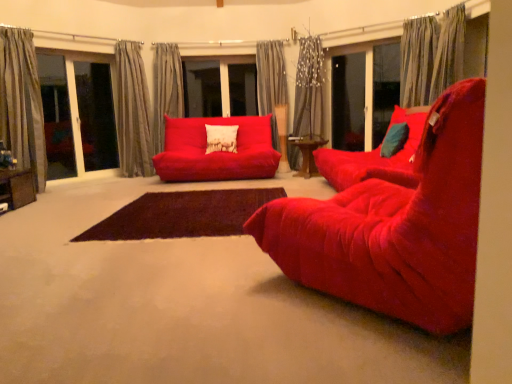
Question: Would you say gray striped curtain at left, which is the 1th curtain in left-to-right order, is a long distance from gray textured curtain at left, which is the fifth curtain in right-to-left order?

Choices:
 (A) yes
 (B) no

Answer: (A)

Question: Is gray striped curtain at left, the sixth curtain from the right, at the left side of gray textured curtain at left, placed as the 2th curtain when sorted from left to right?

Choices:
 (A) yes
 (B) no

Answer: (A)

Question: From the image's perspective, is gray striped curtain at left, the sixth curtain from the right, over gray textured curtain at left, which is the fifth curtain in right-to-left order?

Choices:
 (A) yes
 (B) no

Answer: (B)

Question: Is gray striped curtain at left, the sixth curtain from the right, oriented away from gray textured curtain at left, placed as the 2th curtain when sorted from left to right?

Choices:
 (A) yes
 (B) no

Answer: (B)

Question: Is gray striped curtain at left, which is the 1th curtain in left-to-right order, bigger than gray textured curtain at left, placed as the 2th curtain when sorted from left to right?

Choices:
 (A) yes
 (B) no

Answer: (A)

Question: Is gray striped curtain at left, which is the 1th curtain in left-to-right order, beside gray textured curtain at left, which is the fifth curtain in right-to-left order?

Choices:
 (A) yes
 (B) no

Answer: (B)

Question: From the image's perspective, does wooden table at lower left, the first table positioned from the front, appear lower than gray textured curtain at center, marked as the second curtain in a right-to-left arrangement?

Choices:
 (A) yes
 (B) no

Answer: (A)

Question: Is wooden table at lower left, the first table positioned from the front, wider than gray textured curtain at center, the fifth curtain viewed from the left?

Choices:
 (A) yes
 (B) no

Answer: (A)

Question: Is wooden table at lower left, the second table from the right, positioned with its back to gray textured curtain at center, marked as the second curtain in a right-to-left arrangement?

Choices:
 (A) no
 (B) yes

Answer: (A)

Question: Is wooden table at lower left, the second table from the right, oriented towards gray textured curtain at center, the fifth curtain viewed from the left?

Choices:
 (A) yes
 (B) no

Answer: (A)

Question: Is the depth of wooden table at lower left, which is counted as the 1th table, starting from the left, greater than that of gray textured curtain at center, marked as the second curtain in a right-to-left arrangement?

Choices:
 (A) no
 (B) yes

Answer: (A)

Question: Does wooden table at lower left, which is counted as the 1th table, starting from the left, appear on the left side of gray textured curtain at center, marked as the second curtain in a right-to-left arrangement?

Choices:
 (A) yes
 (B) no

Answer: (A)

Question: Does gray textured curtain at center, marked as the second curtain in a right-to-left arrangement, appear on the right side of velvet red studio couch at center?

Choices:
 (A) no
 (B) yes

Answer: (B)